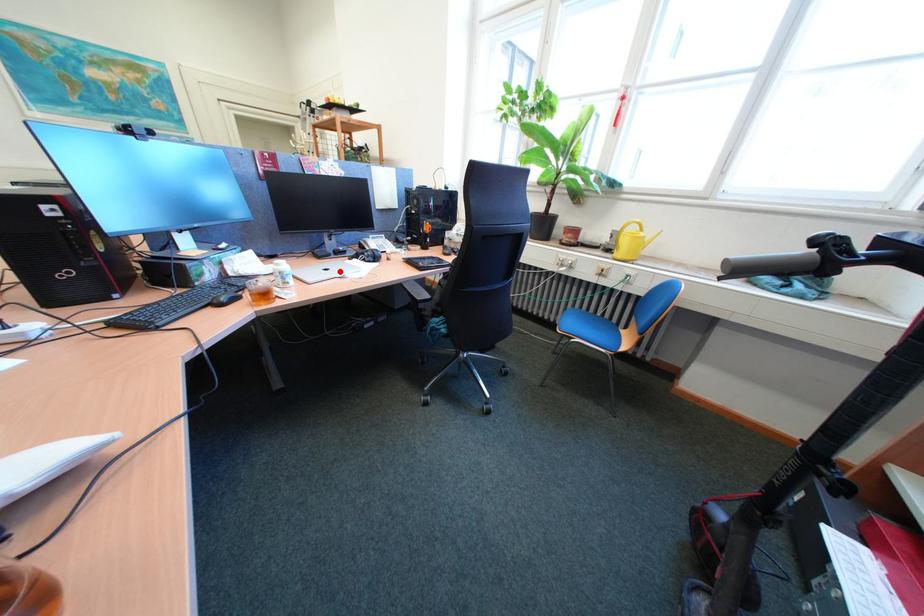
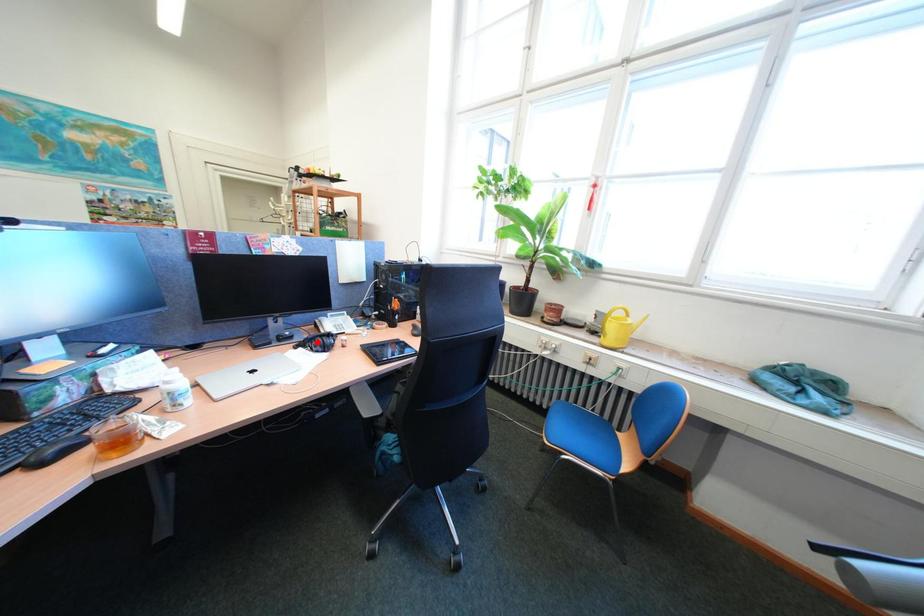
I am providing you with two images of the same scene from different viewpoints. A red point is marked on the first image and another point is marked on the second image. Do the highlighted points in image1 and image2 indicate the same real-world spot?

No